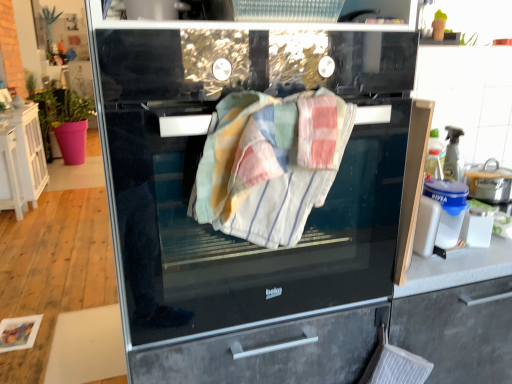
Question: Based on their sizes in the image, would you say black glass oven at center is bigger or smaller than white wood cabinet at left?

Choices:
 (A) small
 (B) big

Answer: (B)

Question: Would you say black glass oven at center is inside or outside white wood cabinet at left?

Choices:
 (A) outside
 (B) inside

Answer: (A)

Question: Considering the real-world distances, which object is farthest from the white wood cabinet at left?

Choices:
 (A) black glass oven at center
 (B) patchwork cotton towel at center
 (C) blue plastic container at right

Answer: (C)

Question: Based on their relative distances, which object is farther from the white wood cabinet at left?

Choices:
 (A) black glass oven at center
 (B) blue plastic container at right
 (C) patchwork cotton towel at center

Answer: (B)